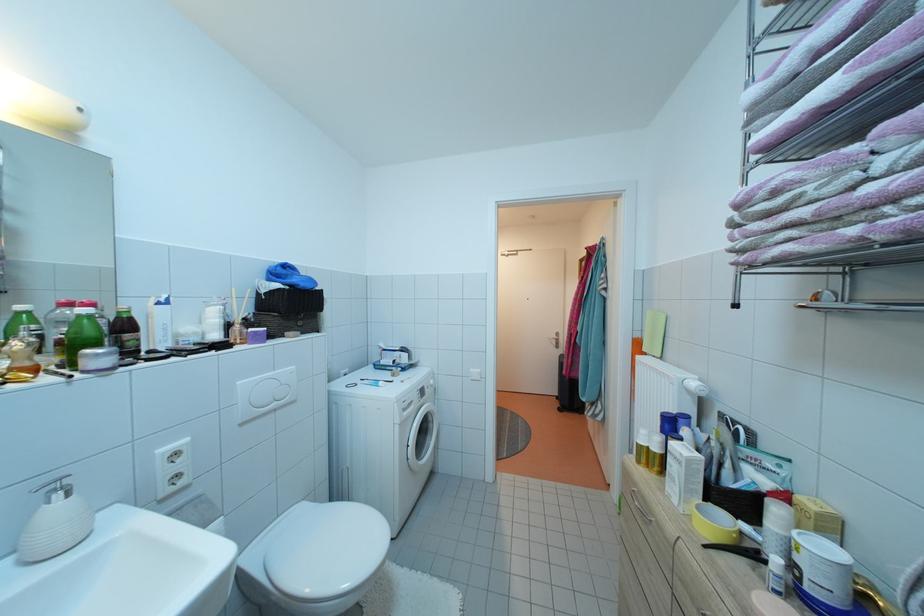
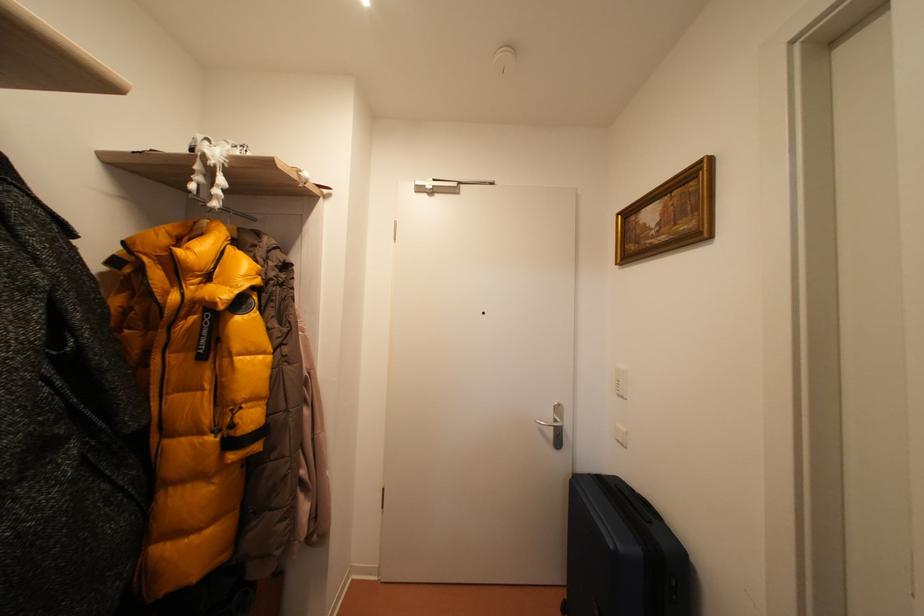
Question: Which direction would the cameraman need to move to produce the second image? Reply with the corresponding letter.

Choices:
 (A) Left
 (B) Right
 (C) Forward
 (D) Backward

Answer: (C)